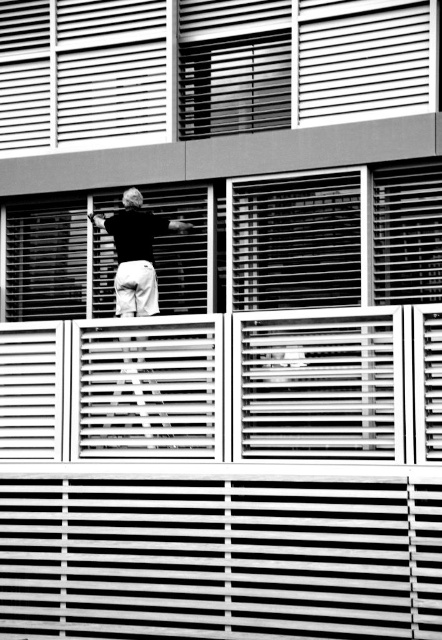
Does white slatted balcony at center have a greater height compared to black matte skateboard at center?

In fact, white slatted balcony at center may be shorter than black matte skateboard at center.

Between white slatted balcony at center and black matte skateboard at center, which one is positioned higher?

black matte skateboard at center is higher up.

Is point (68, 380) farther from viewer compared to point (101, 218)?

No, it is in front of (101, 218).

The height and width of the screenshot is (640, 442). Find the location of `white slatted balcony at center`. white slatted balcony at center is located at coordinates (225, 387).

Who is higher up, white plastic blinds at upper center or black matte skateboard at center?

white plastic blinds at upper center is higher up.

Looking at this image, who is more forward, [380,68] or [138,257]?

Point [380,68]

Identify the location of white plastic blinds at upper center. This screenshot has height=640, width=442. (205, 67).

Consider the image. Does white slatted balcony at center have a greater width compared to white plastic blinds at upper center?

Incorrect, white slatted balcony at center's width does not surpass white plastic blinds at upper center's.

Where is `white slatted balcony at center`? white slatted balcony at center is located at coordinates (225, 387).